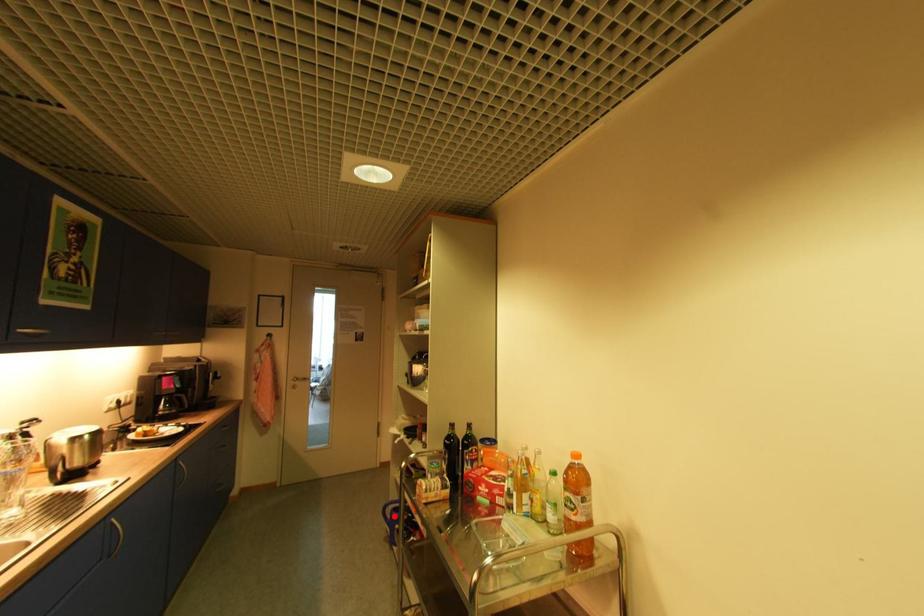
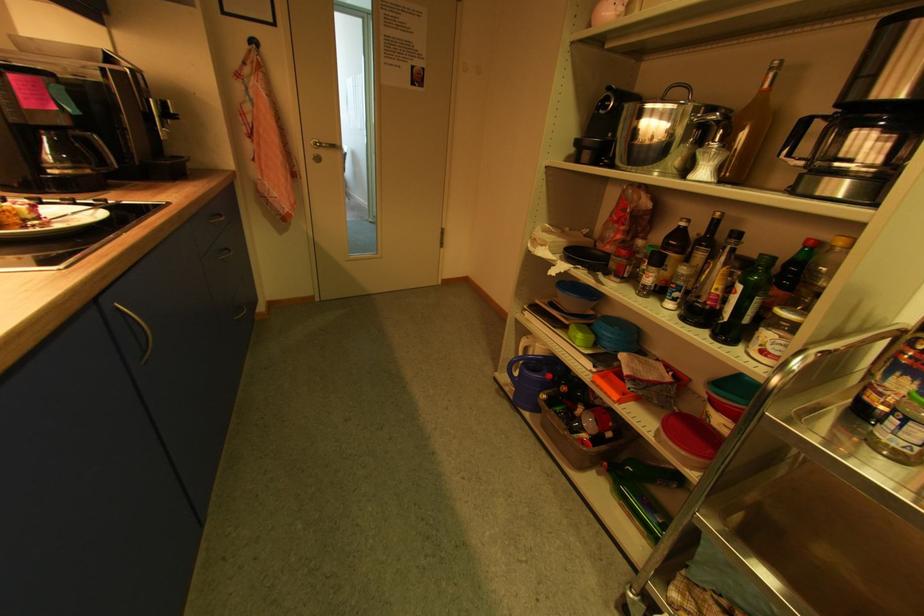
Find the pixel in the second image that matches the highlighted location in the first image.

(521, 375)